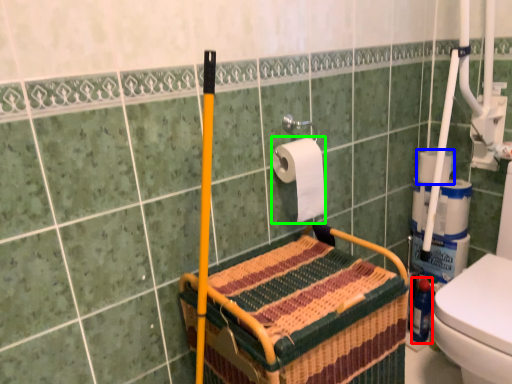
Question: Considering the real-world distances, which object is closest to bottle (highlighted by a red box)? toilet paper (highlighted by a blue box) or toilet paper (highlighted by a green box).

Choices:
 (A) toilet paper
 (B) toilet paper

Answer: (A)